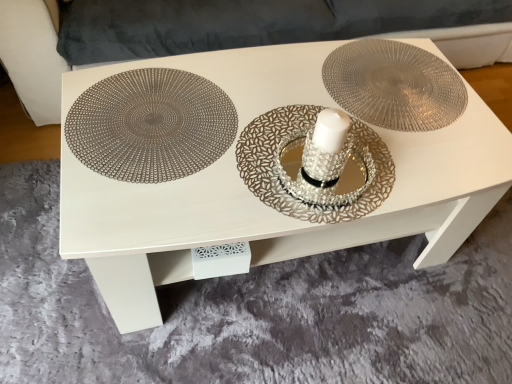
Where is `vacant space to the left of metallic textured saucer at center`? The height and width of the screenshot is (384, 512). vacant space to the left of metallic textured saucer at center is located at coordinates (280, 79).